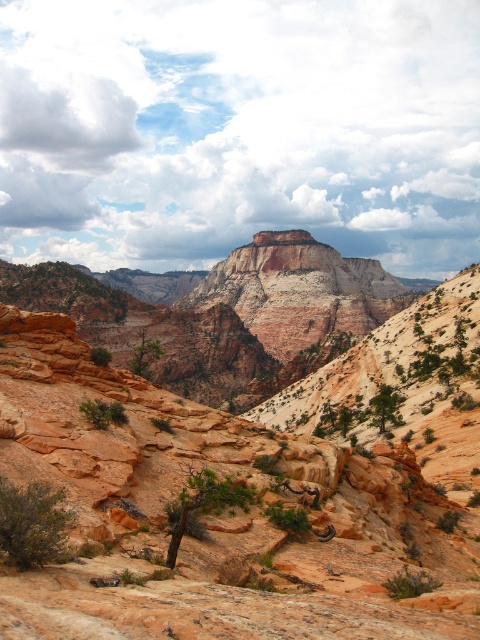
Question: Is green matte tree at center below green leafy tree at center?

Choices:
 (A) no
 (B) yes

Answer: (B)

Question: Which point appears farthest from the camera in this image?

Choices:
 (A) (395, 401)
 (B) (136, 348)

Answer: (B)

Question: Is green leafy bush at lower left in front of green matte tree at center?

Choices:
 (A) no
 (B) yes

Answer: (B)

Question: Which point is closer to the camera?

Choices:
 (A) green leafy shrub at lower left
 (B) green leafy tree at lower left
 (C) green matte tree at center

Answer: (C)

Question: Is green leafy shrub at lower left to the left of green leafy tree at lower left from the viewer's perspective?

Choices:
 (A) yes
 (B) no

Answer: (B)

Question: Among these points, which one is farthest from the camera?

Choices:
 (A) click(x=240, y=492)
 (B) click(x=148, y=352)

Answer: (B)